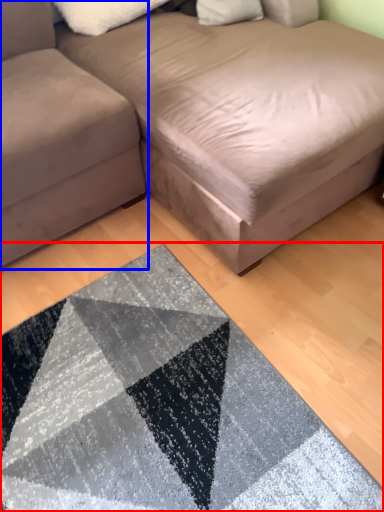
Question: Which of the following is the farthest to the observer, mat (highlighted by a red box) or studio couch (highlighted by a blue box)?

Choices:
 (A) mat
 (B) studio couch

Answer: (B)